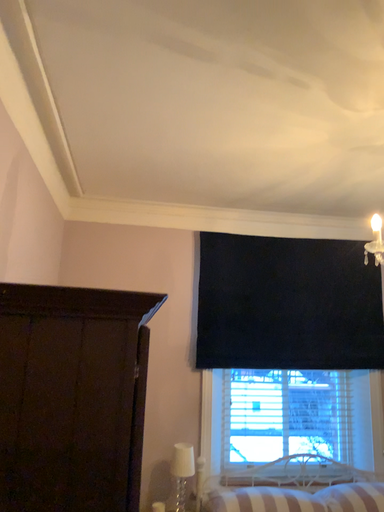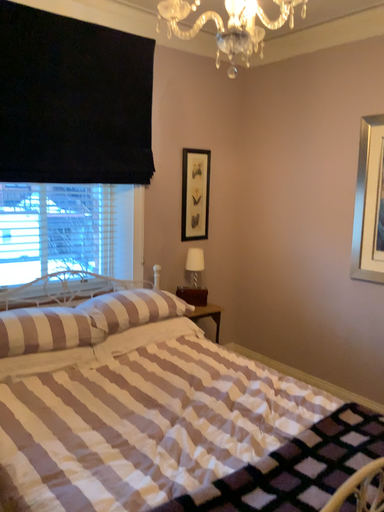
Question: How did the camera likely rotate when shooting the video?

Choices:
 (A) rotated left
 (B) rotated right

Answer: (B)